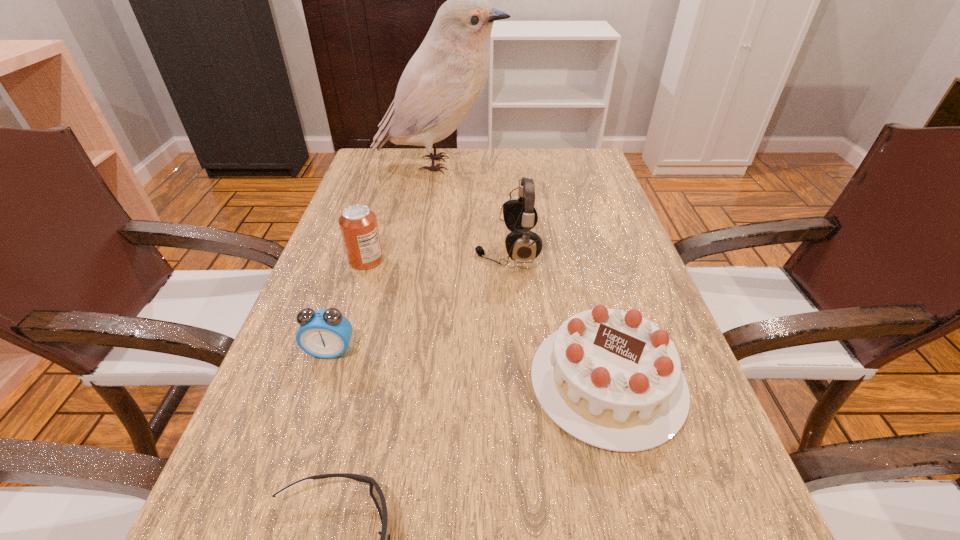
Where is `free space that satisfies the following two spatial constraints: 1. on the face of the farthest object; 2. on the face of the alarm clock`? free space that satisfies the following two spatial constraints: 1. on the face of the farthest object; 2. on the face of the alarm clock is located at coordinates coord(412,351).

Locate an element on the screen. free space in the image that satisfies the following two spatial constraints: 1. with the microphone on the side of the headset; 2. on the back side of the birthday cake is located at coordinates (516, 381).

Where is `vacant area in the image that satisfies the following two spatial constraints: 1. on the face of the birthday cake; 2. on the right side of the alarm clock`? vacant area in the image that satisfies the following two spatial constraints: 1. on the face of the birthday cake; 2. on the right side of the alarm clock is located at coordinates (321, 381).

Where is `free spot that satisfies the following two spatial constraints: 1. on the face of the parakeet; 2. on the front side of the can`? The image size is (960, 540). free spot that satisfies the following two spatial constraints: 1. on the face of the parakeet; 2. on the front side of the can is located at coordinates (425, 260).